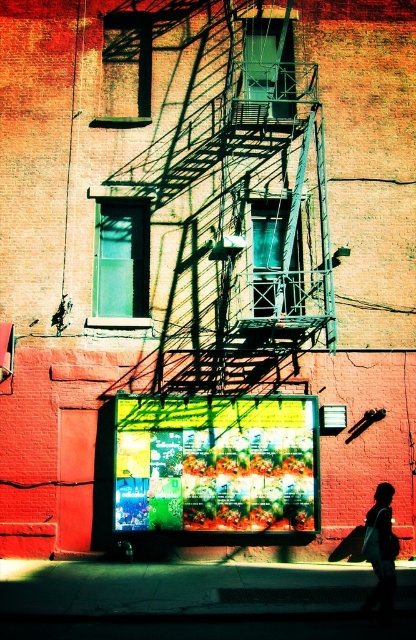
Question: Among these points, which one is nearest to the camera?

Choices:
 (A) (378, 536)
 (B) (71, 132)

Answer: (A)

Question: Does green metal fire escape at center appear on the left side of red wire at upper left?

Choices:
 (A) yes
 (B) no

Answer: (B)

Question: Which object is closer to the camera taking this photo?

Choices:
 (A) green metal fire escape at center
 (B) red wire at upper left
 (C) silhouette bag at lower right

Answer: (C)

Question: Which point appears farthest from the camera in this image?

Choices:
 (A) (235, 384)
 (B) (66, 204)
 (C) (378, 564)

Answer: (B)

Question: Can you confirm if green metal fire escape at center is positioned to the right of red wire at upper left?

Choices:
 (A) no
 (B) yes

Answer: (B)

Question: Does silhouette bag at lower right have a greater width compared to red wire at upper left?

Choices:
 (A) yes
 (B) no

Answer: (A)